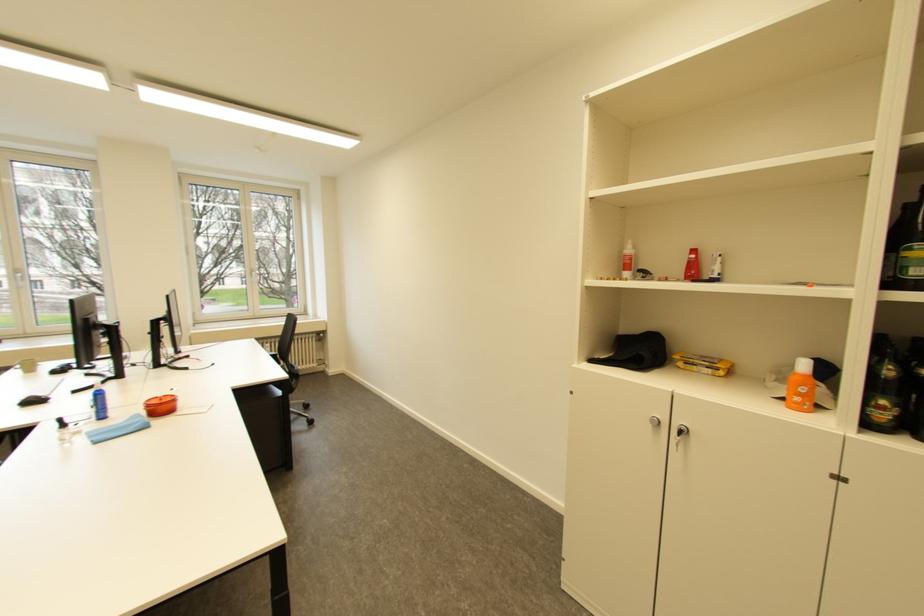
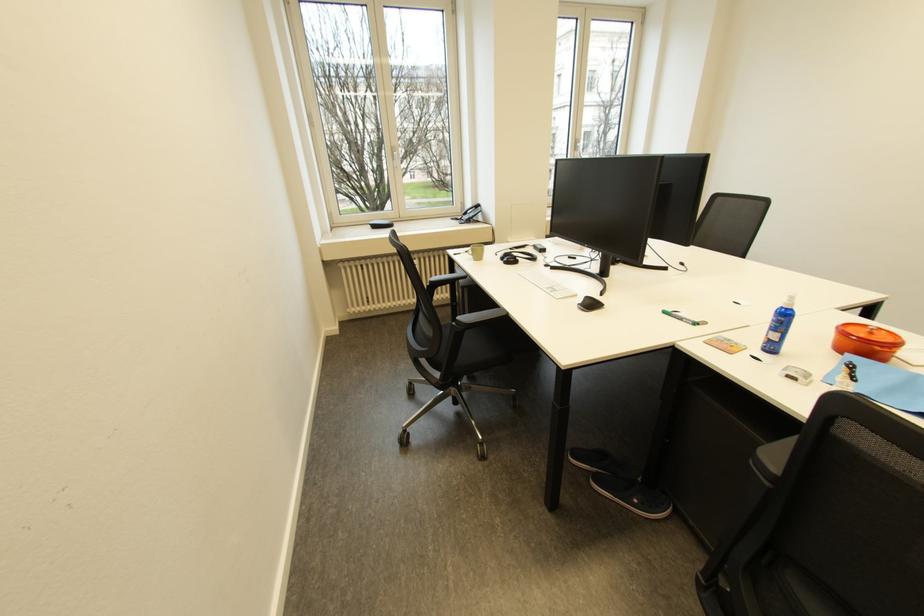
Question: In a continuous first-person perspective shot, in which direction is the camera moving?

Choices:
 (A) Left
 (B) Right
 (C) Forward
 (D) Backward

Answer: (A)